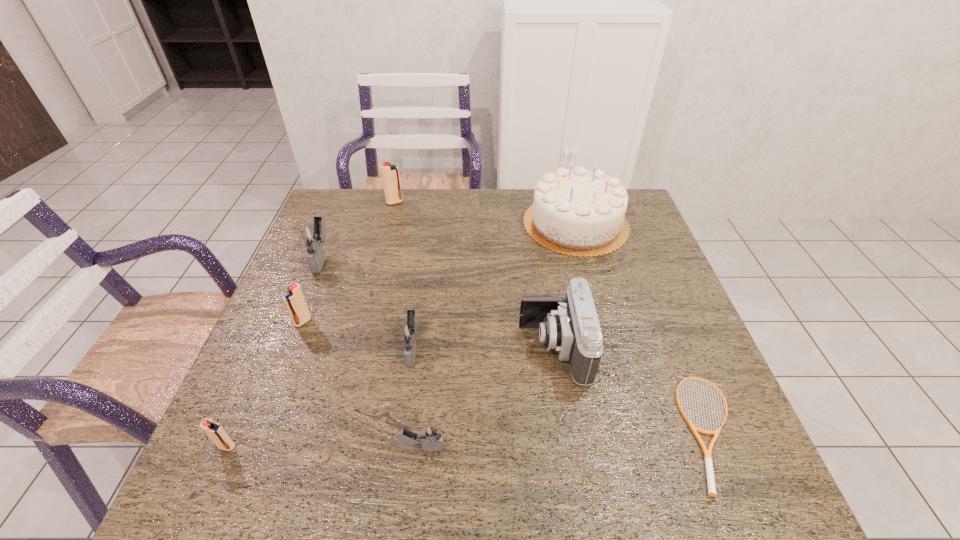
In order to click on birthday cake located at the right edge in this screenshot , I will do `click(576, 212)`.

This screenshot has height=540, width=960. Find the location of `tennis racket that is positioned at the right edge`. tennis racket that is positioned at the right edge is located at coordinates (707, 453).

Find the location of a particular element. This screenshot has height=540, width=960. object situated at the far right corner is located at coordinates (576, 212).

Find the location of a particular element. This screenshot has height=540, width=960. object positioned at the near right corner is located at coordinates (707, 453).

Find the location of `vacant space at the far edge`. vacant space at the far edge is located at coordinates (404, 188).

Locate an element on the screen. The height and width of the screenshot is (540, 960). vacant area at the near edge of the desktop is located at coordinates (478, 505).

In order to click on free point at the left edge in this screenshot , I will do `click(297, 441)`.

In the image, there is a desktop. Identify the location of free region at the right edge. Image resolution: width=960 pixels, height=540 pixels. (660, 295).

The height and width of the screenshot is (540, 960). In the image, there is a desktop. In order to click on vacant space at the near right corner in this screenshot , I will do `click(759, 485)`.

I want to click on empty space that is in between the birthday cake and the beige tennis racket, so click(644, 327).